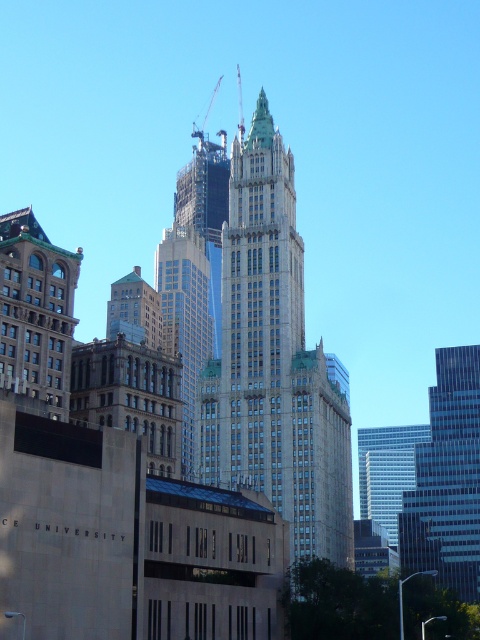
Based on the photo, is silver glass skyscraper at center bigger than metallic gray crane at upper center?

Yes.

Is silver glass skyscraper at center thinner than metallic gray crane at upper center?

In fact, silver glass skyscraper at center might be wider than metallic gray crane at upper center.

Find the location of a particular element. This screenshot has height=640, width=480. silver glass skyscraper at center is located at coordinates point(447,480).

Who is lower down, brown brick building at center-left or metallic gray crane at upper center?

brown brick building at center-left

Does brown brick building at center-left lie behind metallic gray crane at upper center?

No, brown brick building at center-left is in front of metallic gray crane at upper center.

Who is more distant from viewer, (111, 307) or (205, 116)?

Positioned behind is point (205, 116).

Find the location of a particular element. The width and height of the screenshot is (480, 640). brown brick building at center-left is located at coordinates (133, 310).

Does beige stone tower at center have a smaller size compared to green stone tower at left?

No.

Does beige stone tower at center have a lesser height compared to green stone tower at left?

In fact, beige stone tower at center may be taller than green stone tower at left.

Is point (252, 332) positioned in front of point (28, 234)?

No, it is behind (28, 234).

I want to click on beige stone tower at center, so click(274, 364).